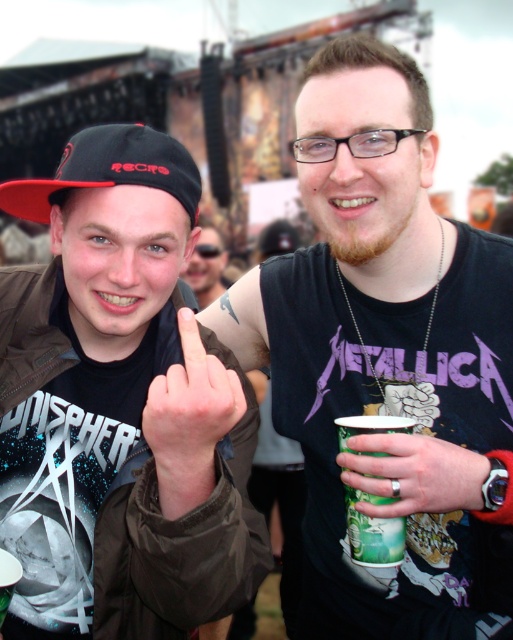
Is point (113, 152) less distant than point (400, 433)?

That is False.

Does black fabric baseball cap at upper left have a greater width compared to green paper cup at lower center?

Correct, the width of black fabric baseball cap at upper left exceeds that of green paper cup at lower center.

Identify the location of black fabric baseball cap at upper left. (108, 170).

Locate an element on the screen. The width and height of the screenshot is (513, 640). black fabric baseball cap at upper left is located at coordinates pos(108,170).

Who is positioned more to the right, matte black cap at left or black fabric baseball cap at upper left?

matte black cap at left is more to the right.

Consider the image. Between matte black cap at left and black fabric baseball cap at upper left, which one has less height?

→ Standing shorter between the two is matte black cap at left.

Which is behind, point (37, 592) or point (102, 186)?

The point (37, 592) is behind.

Identify the location of matte black cap at left. The image size is (513, 640). (120, 406).

Can you confirm if black fabric baseball cap at upper left is positioned below skinny finger at center?

No.

Is point (123, 132) positioned before point (181, 349)?

Yes.

Measure the distance between point (169,138) and camera.

They are 86.90 feet apart.

Locate an element on the screen. black fabric baseball cap at upper left is located at coordinates (108, 170).